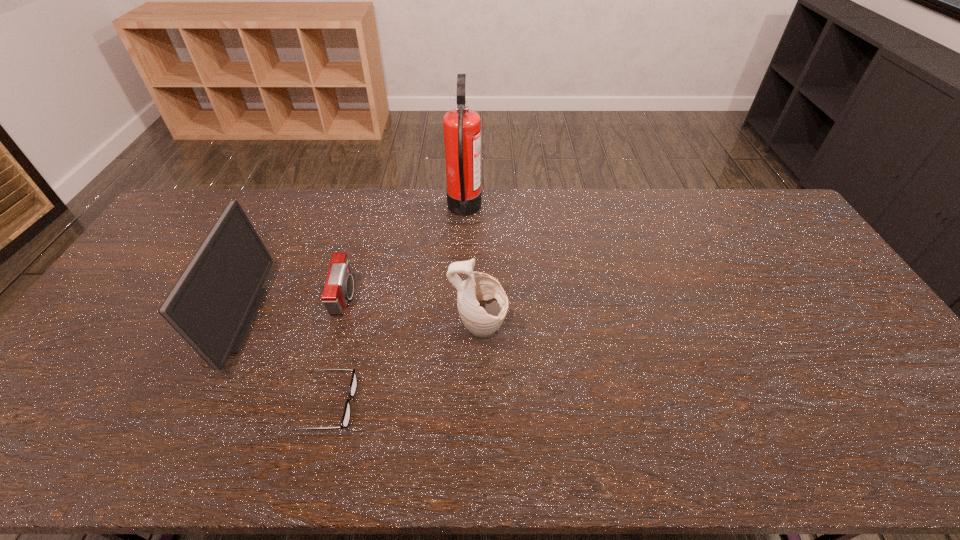
The width and height of the screenshot is (960, 540). I want to click on vacant point located on the front-facing side of the shortest object, so click(x=437, y=404).

The width and height of the screenshot is (960, 540). What are the coordinates of `object that is positioned at the far edge` in the screenshot? It's located at (462, 127).

Identify the location of object that is at the near edge. (345, 420).

In order to click on vacant space at the far edge in this screenshot , I will do `click(697, 201)`.

Image resolution: width=960 pixels, height=540 pixels. Find the location of `vacant space at the near edge of the desktop`. vacant space at the near edge of the desktop is located at coordinates (868, 439).

At what (x,y) coordinates should I click in order to perform the action: click on vacant region at the right edge of the desktop. Please return your answer as a coordinate pair (x, y). Image resolution: width=960 pixels, height=540 pixels. Looking at the image, I should click on (831, 348).

The image size is (960, 540). What are the coordinates of `free location at the far left corner of the desktop` in the screenshot? It's located at (180, 211).

At what (x,y) coordinates should I click in order to perform the action: click on vacant point located between the pitcher and the computer monitor. Please return your answer as a coordinate pair (x, y). Looking at the image, I should click on pos(355,325).

Where is `free spot between the second shortest object and the computer monitor`? Image resolution: width=960 pixels, height=540 pixels. free spot between the second shortest object and the computer monitor is located at coordinates (288, 308).

Identify the location of empty location between the spectacles and the computer monitor. This screenshot has width=960, height=540. (279, 362).